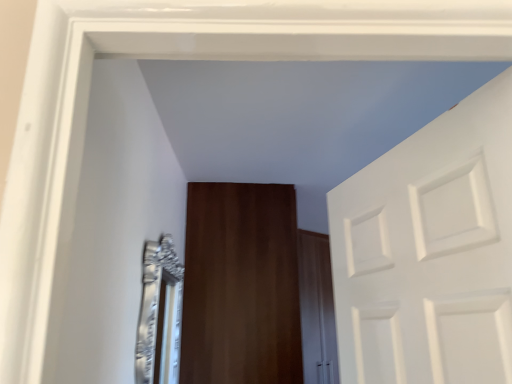
This screenshot has width=512, height=384. What do you see at coordinates (241, 285) in the screenshot?
I see `wooden door at center` at bounding box center [241, 285].

Find the location of a particular element. The width and height of the screenshot is (512, 384). wooden door at center is located at coordinates (241, 285).

In order to face silver metallic mirror at left, should I rotate leftwards or rightwards?

Rotate left and turn 12.019 degrees.

What do you see at coordinates (159, 314) in the screenshot? The image size is (512, 384). I see `silver metallic mirror at left` at bounding box center [159, 314].

I want to click on silver metallic mirror at left, so click(x=159, y=314).

Where is `wooden door at center`? The height and width of the screenshot is (384, 512). wooden door at center is located at coordinates (241, 285).

Which is more to the left, wooden door at center or silver metallic mirror at left?

Positioned to the left is silver metallic mirror at left.

In the image, is wooden door at center positioned in front of or behind silver metallic mirror at left?

wooden door at center is positioned farther from the viewer than silver metallic mirror at left.

Which is less distant, (230, 313) or (155, 339)?

The point (155, 339) is in front.

From the image's perspective, which is above, wooden door at center or silver metallic mirror at left?

From the image's view, silver metallic mirror at left is above.

From a real-world perspective, is wooden door at center under silver metallic mirror at left?

No, from a real-world perspective, wooden door at center is not below silver metallic mirror at left.

In terms of width, does wooden door at center look wider or thinner when compared to silver metallic mirror at left?

Clearly, wooden door at center has more width compared to silver metallic mirror at left.

Consider the image. Can you confirm if wooden door at center is taller than silver metallic mirror at left?

Yes.

Considering the relative sizes of wooden door at center and silver metallic mirror at left in the image provided, is wooden door at center bigger than silver metallic mirror at left?

Indeed, wooden door at center has a larger size compared to silver metallic mirror at left.

Is wooden door at center not within silver metallic mirror at left?

wooden door at center is positioned outside silver metallic mirror at left.

Is wooden door at center with silver metallic mirror at left?

No, wooden door at center is not in contact with silver metallic mirror at left.

Could you tell me if wooden door at center is facing silver metallic mirror at left?

No, wooden door at center does not turn towards silver metallic mirror at left.

What's the angular difference between wooden door at center and silver metallic mirror at left's facing directions?

The angle between the facing direction of wooden door at center and the facing direction of silver metallic mirror at left is 0.977 degrees.

How far apart are wooden door at center and silver metallic mirror at left?

They are 15.08 inches apart.

I want to click on mirror that is on the left side of wooden door at center, so click(159, 314).

From the picture: Which object is positioned more to the right, silver metallic mirror at left or wooden door at center?

Positioned to the right is wooden door at center.

Which object is further away from the camera, silver metallic mirror at left or wooden door at center?

wooden door at center.

Which is in front, point (143, 337) or point (252, 240)?

The point (143, 337) is closer to the camera.

From the image's perspective, does silver metallic mirror at left appear higher than wooden door at center?

Indeed, from the image's perspective, silver metallic mirror at left is shown above wooden door at center.

From a real-world perspective, is silver metallic mirror at left physically above wooden door at center?

No, from a real-world perspective, silver metallic mirror at left is not above wooden door at center.

Considering the sizes of objects silver metallic mirror at left and wooden door at center in the image provided, who is thinner, silver metallic mirror at left or wooden door at center?

silver metallic mirror at left is thinner.

Can you confirm if silver metallic mirror at left is taller than wooden door at center?

In fact, silver metallic mirror at left may be shorter than wooden door at center.

From the picture: Which of these two, silver metallic mirror at left or wooden door at center, is bigger?

wooden door at center is bigger.

Is wooden door at center completely or partially inside silver metallic mirror at left?

No, wooden door at center is not a part of silver metallic mirror at left.

Is silver metallic mirror at left in contact with wooden door at center?

No.

Is silver metallic mirror at left turned away from wooden door at center?

No, wooden door at center is not at the back of silver metallic mirror at left.

How different are the orientations of silver metallic mirror at left and wooden door at center in degrees?

0.977 degrees.

I want to click on door located below the silver metallic mirror at left (from the image's perspective), so click(x=241, y=285).

This screenshot has width=512, height=384. I want to click on door behind the silver metallic mirror at left, so click(x=241, y=285).

Locate an element on the screen. The height and width of the screenshot is (384, 512). door below the silver metallic mirror at left (from the image's perspective) is located at coordinates (x=241, y=285).